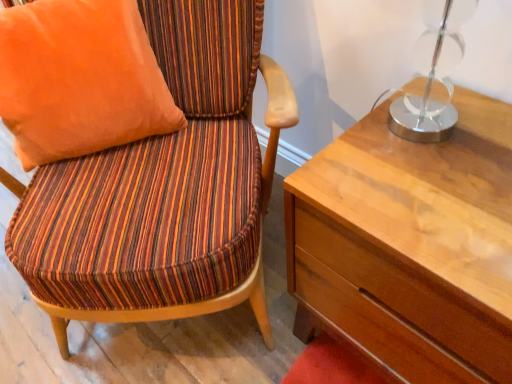
Question: Considering the relative positions of orange fabric pillow at upper left and striped fabric chair at left in the image provided, is orange fabric pillow at upper left to the left or to the right of striped fabric chair at left?

Choices:
 (A) left
 (B) right

Answer: (A)

Question: Is orange fabric pillow at upper left wider or thinner than striped fabric chair at left?

Choices:
 (A) wide
 (B) thin

Answer: (B)

Question: From a real-world perspective, relative to striped fabric chair at left, is orange fabric pillow at upper left vertically above or below?

Choices:
 (A) above
 (B) below

Answer: (A)

Question: From a real-world perspective, is striped fabric chair at left physically located above or below orange fabric pillow at upper left?

Choices:
 (A) above
 (B) below

Answer: (B)

Question: Would you say striped fabric chair at left is to the left or to the right of orange fabric pillow at upper left in the picture?

Choices:
 (A) left
 (B) right

Answer: (B)

Question: Is striped fabric chair at left taller or shorter than orange fabric pillow at upper left?

Choices:
 (A) tall
 (B) short

Answer: (A)

Question: In terms of width, does striped fabric chair at left look wider or thinner when compared to orange fabric pillow at upper left?

Choices:
 (A) wide
 (B) thin

Answer: (A)